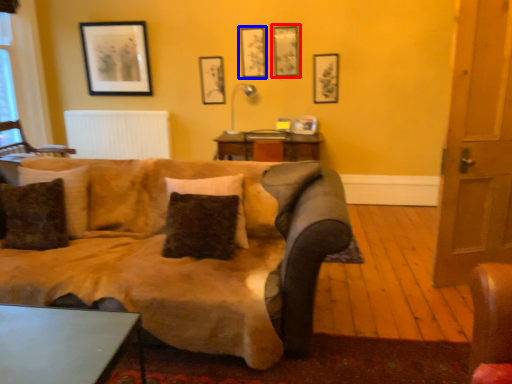
Question: Among these objects, which one is farthest to the camera, picture frame (highlighted by a red box) or picture frame (highlighted by a blue box)?

Choices:
 (A) picture frame
 (B) picture frame

Answer: (B)